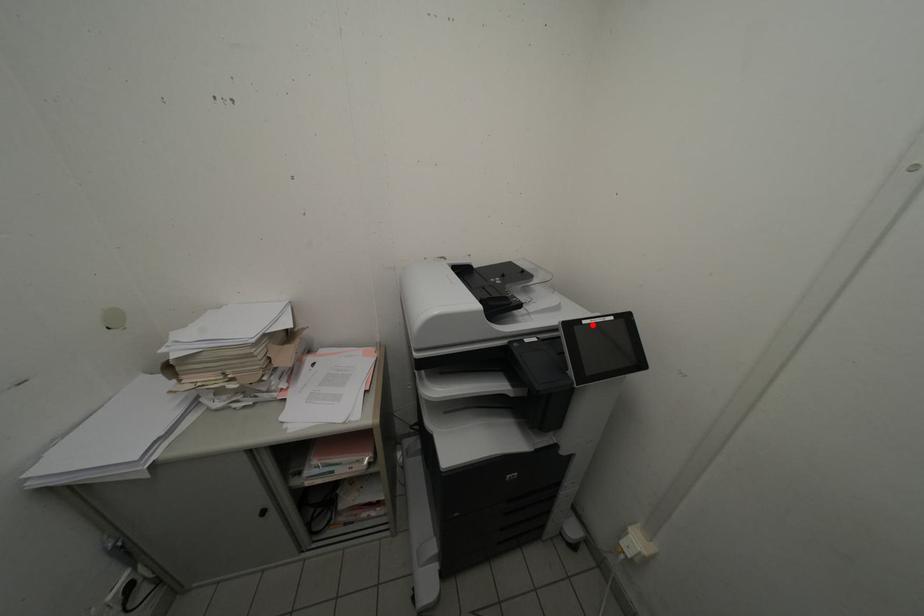
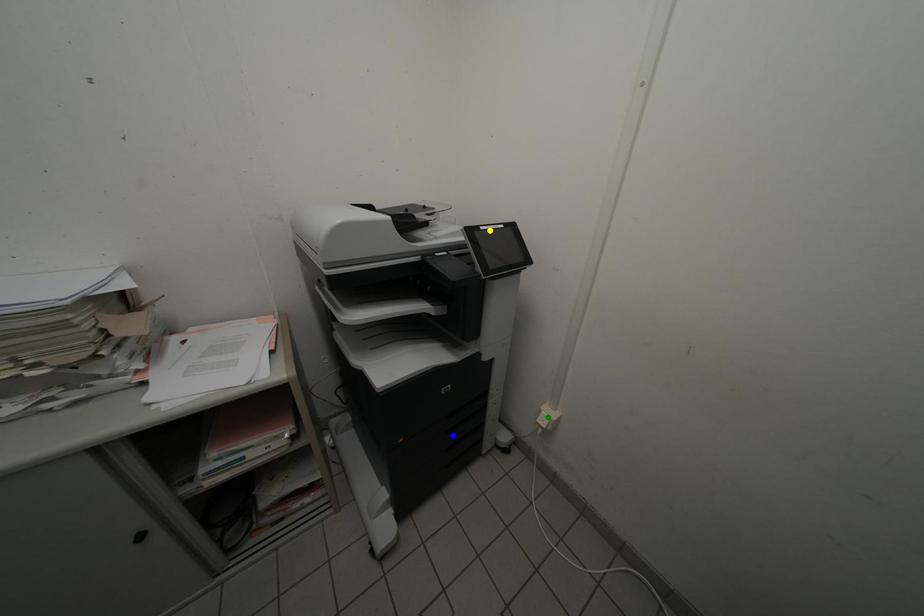
Question: I am providing you with two images of the same scene from different viewpoints. A red point is marked on the first image. You are given multiple points on the second image. Which mark in image 2 goes with the point in image 1?

Choices:
 (A) yellow point
 (B) blue point
 (C) green point

Answer: (A)